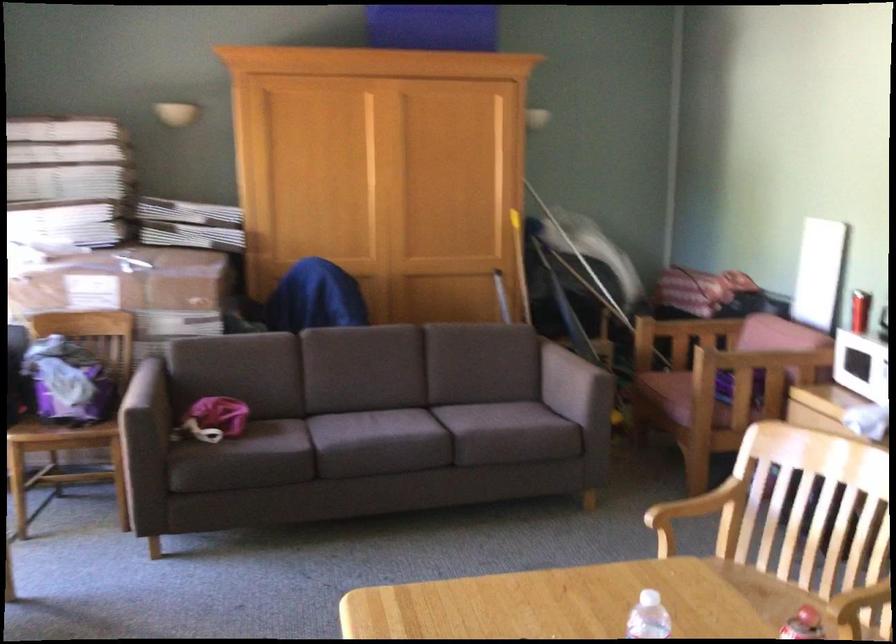
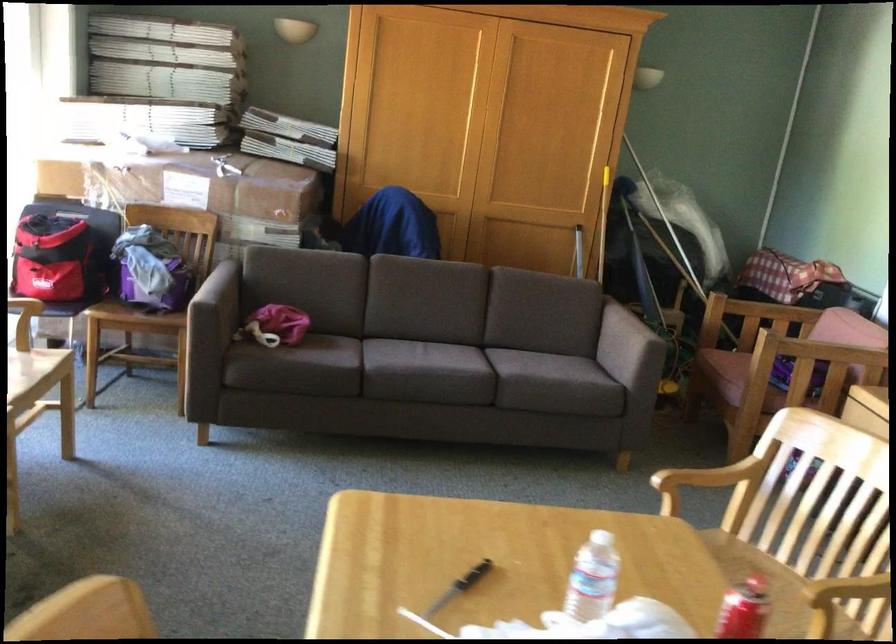
Find the pixel in the second image that matches (x=648, y=617) in the first image.

(617, 562)